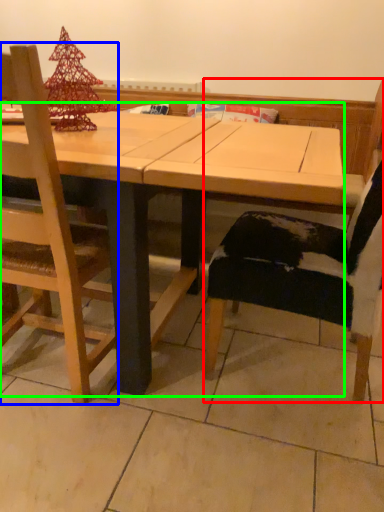
Question: Considering the real-world distances, which object is closest to chair (highlighted by a red box)? chair (highlighted by a blue box) or table (highlighted by a green box).

Choices:
 (A) chair
 (B) table

Answer: (B)